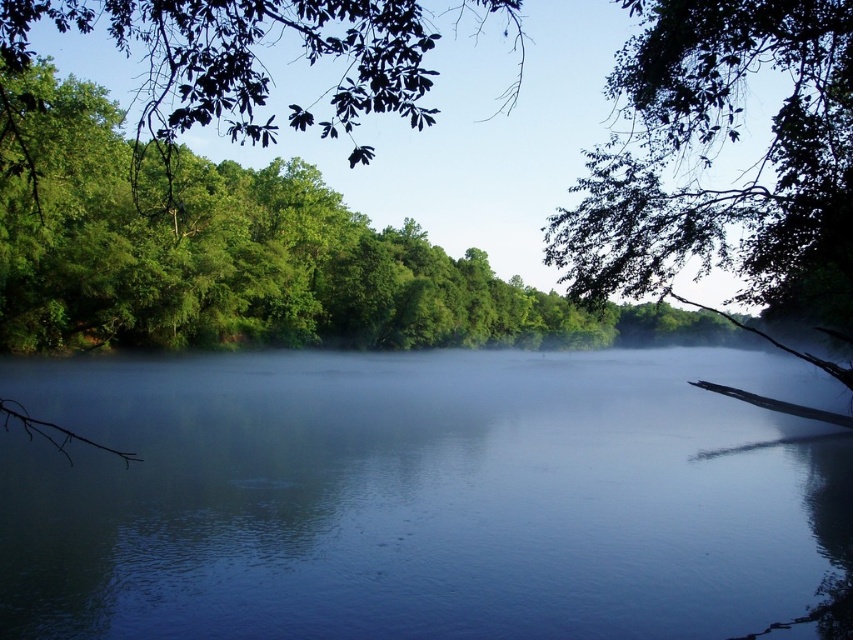
Question: Estimate the real-world distances between objects in this image. Which object is closer to the green leafy branch at upper right?

Choices:
 (A) green leafy tree at upper left
 (B) blue reflective water at center

Answer: (B)

Question: Which of the following is the closest to the observer?

Choices:
 (A) green leafy tree at upper left
 (B) blue reflective water at center

Answer: (A)

Question: Can you confirm if green leafy tree at upper left is bigger than green leafy branch at upper right?

Choices:
 (A) yes
 (B) no

Answer: (A)

Question: Considering the real-world distances, which object is closest to the blue reflective water at center?

Choices:
 (A) green leafy tree at upper left
 (B) green leafy branch at upper right

Answer: (B)

Question: In this image, where is blue reflective water at center located relative to green leafy branch at upper right?

Choices:
 (A) above
 (B) below

Answer: (B)

Question: Can you confirm if blue reflective water at center is positioned to the right of green leafy branch at upper right?

Choices:
 (A) yes
 (B) no

Answer: (B)